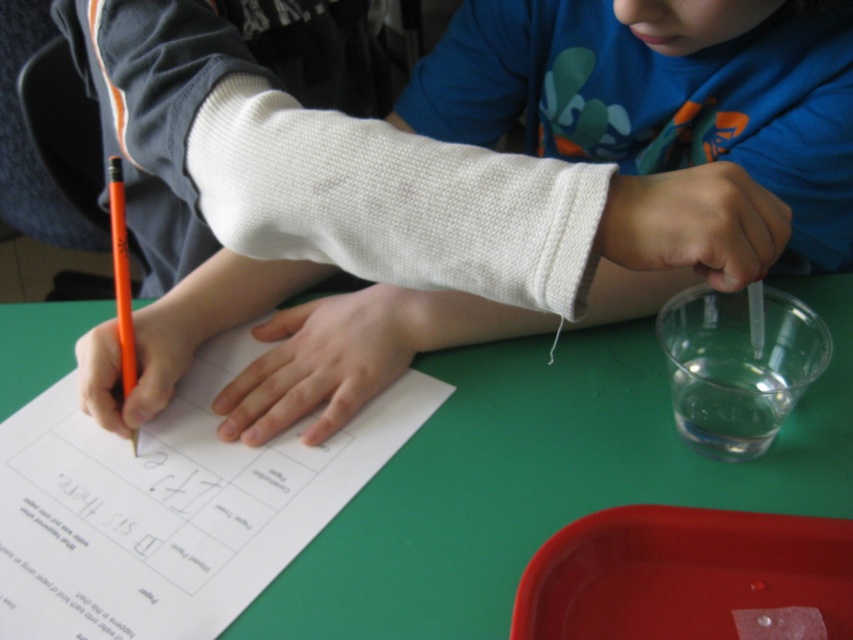
Is white knitted cast at upper center below orange matte pencil at left?

Actually, white knitted cast at upper center is above orange matte pencil at left.

Does white knitted cast at upper center appear over orange matte pencil at left?

Indeed, white knitted cast at upper center is positioned over orange matte pencil at left.

This screenshot has width=853, height=640. Find the location of `white knitted cast at upper center`. white knitted cast at upper center is located at coordinates (660, 93).

The height and width of the screenshot is (640, 853). Identify the location of white knitted cast at upper center. (660, 93).

Is point (448, 45) closer to viewer compared to point (596, 403)?

No, (448, 45) is behind (596, 403).

Who is lower down, white knitted cast at upper center or green matte table at center?

green matte table at center is lower down.

This screenshot has height=640, width=853. What are the coordinates of `white knitted cast at upper center` in the screenshot? It's located at (660, 93).

Identify the location of white knitted cast at upper center. This screenshot has width=853, height=640. (660, 93).

Who is positioned more to the left, green matte table at center or transparent plastic cup at right?

green matte table at center

Does green matte table at center appear under transparent plastic cup at right?

Indeed, green matte table at center is positioned under transparent plastic cup at right.

Describe the element at coordinates (543, 477) in the screenshot. I see `green matte table at center` at that location.

The height and width of the screenshot is (640, 853). Find the location of `green matte table at center`. green matte table at center is located at coordinates (543, 477).